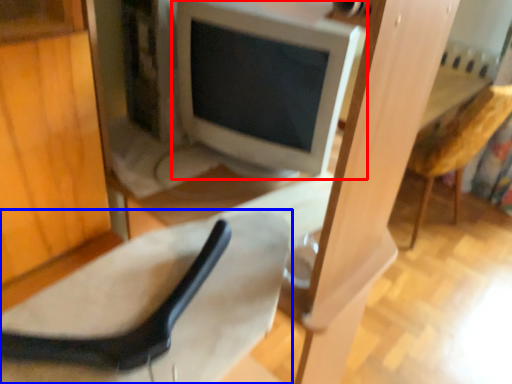
Question: Which object appears closest to the camera in this image, computer monitor (highlighted by a red box) or chair (highlighted by a blue box)?

Choices:
 (A) computer monitor
 (B) chair

Answer: (B)